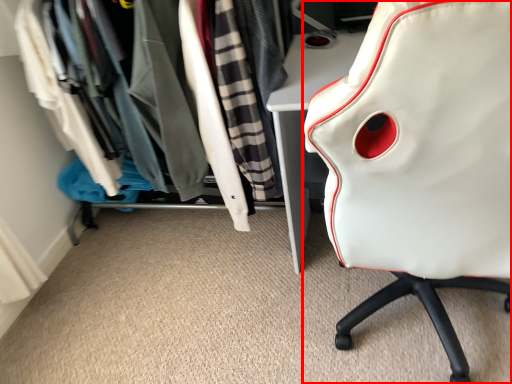
Question: In this image, where is chair (annotated by the red box) located relative to closet?

Choices:
 (A) right
 (B) left

Answer: (A)